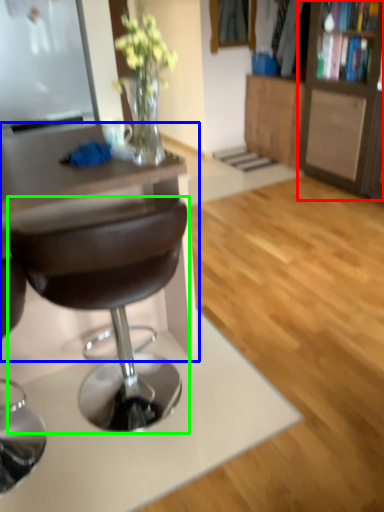
Question: Which is farther away from cabinetry (highlighted by a red box)? desk (highlighted by a blue box) or chair (highlighted by a green box)?

Choices:
 (A) desk
 (B) chair

Answer: (B)